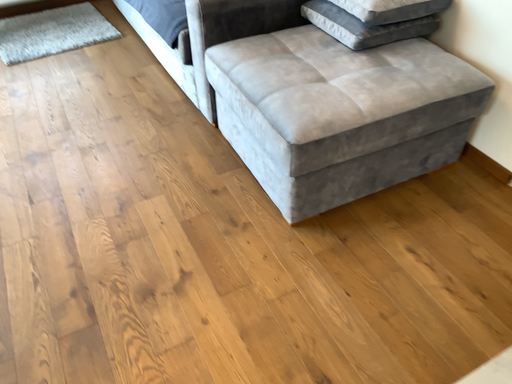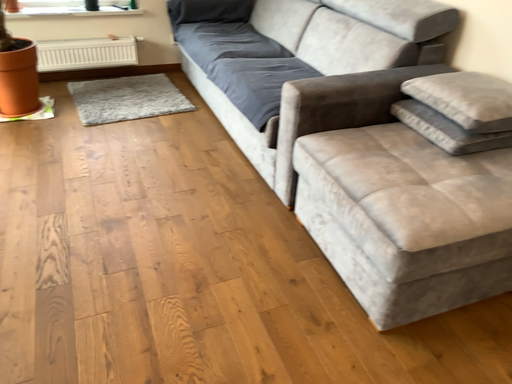
Question: How did the camera likely rotate when shooting the video?

Choices:
 (A) rotated downward
 (B) rotated upward

Answer: (B)